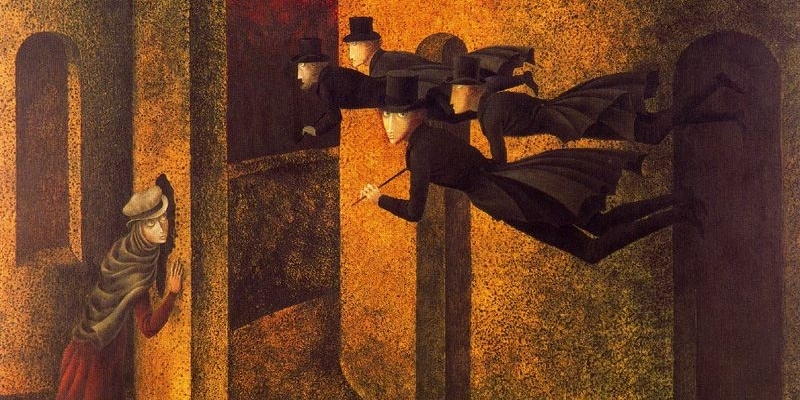
Identify the location of wall. The width and height of the screenshot is (800, 400). (378, 282), (165, 129).